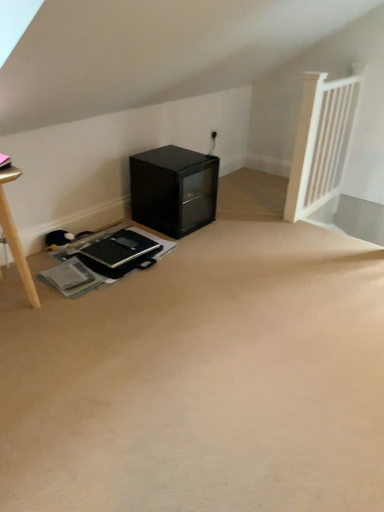
Question: Choose the correct answer: Is black glass cabinet at lower center inside black matte laptop at center or outside it?

Choices:
 (A) outside
 (B) inside

Answer: (A)

Question: From the image's perspective, is black glass cabinet at lower center located above or below black matte laptop at center?

Choices:
 (A) above
 (B) below

Answer: (A)

Question: Considering the positions of point (177, 176) and point (112, 252), is point (177, 176) closer or farther from the camera than point (112, 252)?

Choices:
 (A) farther
 (B) closer

Answer: (A)

Question: In terms of size, does black matte laptop at center appear bigger or smaller than black glass cabinet at lower center?

Choices:
 (A) big
 (B) small

Answer: (B)

Question: In the image, is black matte laptop at center positioned in front of or behind black glass cabinet at lower center?

Choices:
 (A) behind
 (B) front

Answer: (B)

Question: In the image, is black matte laptop at center on the left side or the right side of black glass cabinet at lower center?

Choices:
 (A) left
 (B) right

Answer: (A)

Question: From their relative heights in the image, would you say black matte laptop at center is taller or shorter than black glass cabinet at lower center?

Choices:
 (A) short
 (B) tall

Answer: (A)